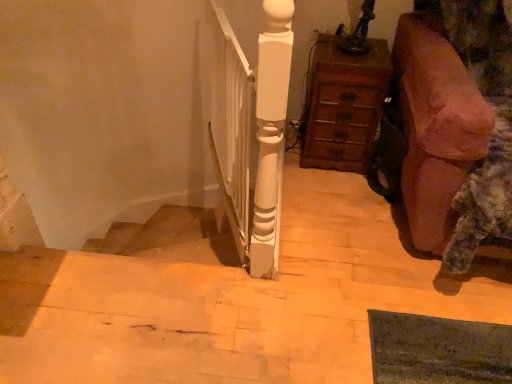
Question: Should I look upward or downward to see wooden chest of drawers at right?

Choices:
 (A) up
 (B) down

Answer: (A)

Question: Is white glossy wooden post at center to the left of brown fabric couch at right from the viewer's perspective?

Choices:
 (A) no
 (B) yes

Answer: (B)

Question: Does white glossy wooden post at center have a larger size compared to brown fabric couch at right?

Choices:
 (A) no
 (B) yes

Answer: (A)

Question: Can you confirm if white glossy wooden post at center is smaller than brown fabric couch at right?

Choices:
 (A) no
 (B) yes

Answer: (B)

Question: Considering the relative positions of white glossy wooden post at center and brown fabric couch at right in the image provided, is white glossy wooden post at center to the right of brown fabric couch at right from the viewer's perspective?

Choices:
 (A) no
 (B) yes

Answer: (A)

Question: Is white glossy wooden post at center oriented towards brown fabric couch at right?

Choices:
 (A) yes
 (B) no

Answer: (B)

Question: From the image's perspective, is white glossy wooden post at center located above brown fabric couch at right?

Choices:
 (A) yes
 (B) no

Answer: (A)

Question: Could wooden chest of drawers at right be considered to be inside white glossy wooden post at center?

Choices:
 (A) no
 (B) yes

Answer: (A)

Question: Considering the relative sizes of white glossy wooden post at center and wooden chest of drawers at right in the image provided, is white glossy wooden post at center taller than wooden chest of drawers at right?

Choices:
 (A) yes
 (B) no

Answer: (A)

Question: From a real-world perspective, does white glossy wooden post at center stand above wooden chest of drawers at right?

Choices:
 (A) yes
 (B) no

Answer: (A)

Question: Is white glossy wooden post at center aimed at wooden chest of drawers at right?

Choices:
 (A) yes
 (B) no

Answer: (A)

Question: From the image's perspective, does white glossy wooden post at center appear lower than wooden chest of drawers at right?

Choices:
 (A) no
 (B) yes

Answer: (B)

Question: Is white glossy wooden post at center smaller than wooden chest of drawers at right?

Choices:
 (A) no
 (B) yes

Answer: (A)

Question: Is brown fabric couch at right located within wooden chest of drawers at right?

Choices:
 (A) yes
 (B) no

Answer: (B)